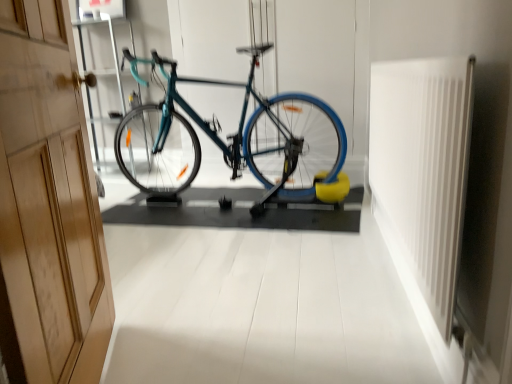
Question: Is teal glossy bicycle at center not near white plastic radiator at right?

Choices:
 (A) no
 (B) yes

Answer: (B)

Question: Is teal glossy bicycle at center completely or partially outside of white plastic radiator at right?

Choices:
 (A) yes
 (B) no

Answer: (A)

Question: Is teal glossy bicycle at center with white plastic radiator at right?

Choices:
 (A) yes
 (B) no

Answer: (B)

Question: From a real-world perspective, is teal glossy bicycle at center under white plastic radiator at right?

Choices:
 (A) no
 (B) yes

Answer: (A)

Question: Does teal glossy bicycle at center have a smaller size compared to white plastic radiator at right?

Choices:
 (A) no
 (B) yes

Answer: (A)

Question: From the image's perspective, is teal glossy bicycle at center above white plastic radiator at right?

Choices:
 (A) no
 (B) yes

Answer: (B)

Question: Does white plastic radiator at right appear on the left side of wooden at left?

Choices:
 (A) no
 (B) yes

Answer: (A)

Question: Is white plastic radiator at right thinner than wooden at left?

Choices:
 (A) no
 (B) yes

Answer: (B)

Question: From a real-world perspective, is white plastic radiator at right located higher than wooden at left?

Choices:
 (A) yes
 (B) no

Answer: (B)

Question: Are white plastic radiator at right and wooden at left beside each other?

Choices:
 (A) yes
 (B) no

Answer: (B)

Question: Are white plastic radiator at right and wooden at left located far from each other?

Choices:
 (A) yes
 (B) no

Answer: (A)

Question: Is white plastic radiator at right oriented towards wooden at left?

Choices:
 (A) no
 (B) yes

Answer: (B)

Question: Is there a large distance between wooden at left and teal glossy bicycle at center?

Choices:
 (A) no
 (B) yes

Answer: (B)